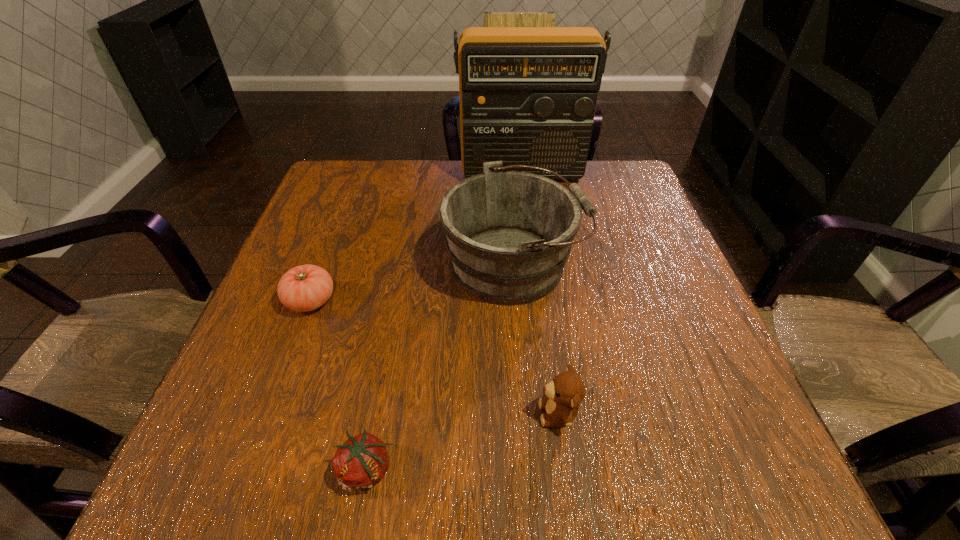
The width and height of the screenshot is (960, 540). What are the coordinates of `vacant region located on the back of the fourth shortest object` in the screenshot? It's located at [508, 186].

The image size is (960, 540). I want to click on vacant space situated on the face of the fourth farthest object, so click(x=451, y=414).

This screenshot has width=960, height=540. In order to click on vacant space located 0.370m on the face of the fourth farthest object in this screenshot , I will do `click(307, 414)`.

Image resolution: width=960 pixels, height=540 pixels. Find the location of `vacant space located 0.320m on the face of the fourth farthest object`. vacant space located 0.320m on the face of the fourth farthest object is located at coordinates (338, 414).

Image resolution: width=960 pixels, height=540 pixels. Find the location of `free space located 0.190m on the front of the second shortest object`. free space located 0.190m on the front of the second shortest object is located at coordinates (269, 411).

What are the coordinates of `vacant space located 0.080m on the back of the shorter tomato` in the screenshot? It's located at (380, 396).

You are a GUI agent. You are given a task and a screenshot of the screen. Output one action in this format:
    pyautogui.click(x=<x>, y=<y>)
    Task: Click on the object situated at the far edge
    This screenshot has width=960, height=540.
    Given the screenshot: What is the action you would take?
    pyautogui.click(x=528, y=95)

Where is `object that is at the near edge`? Image resolution: width=960 pixels, height=540 pixels. object that is at the near edge is located at coordinates (361, 461).

Where is `object that is positioned at the left edge`? object that is positioned at the left edge is located at coordinates 303,288.

At what (x,y) coordinates should I click in order to perform the action: click on object that is at the right edge. Please return your answer as a coordinate pair (x, y). Looking at the image, I should click on (528, 95).